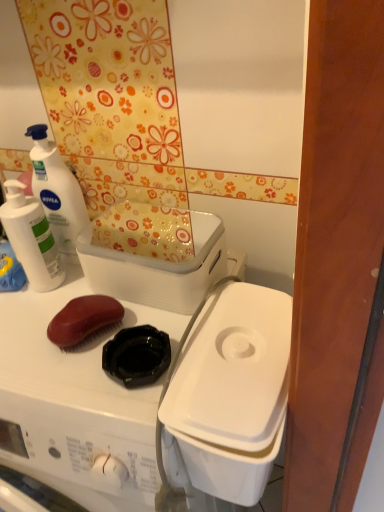
Locate an element on the screen. This screenshot has height=512, width=384. empty space that is ontop of white plastic container at center-right, which is counted as the 2th appliance, starting from the top (from a real-world perspective) is located at coordinates (243, 350).